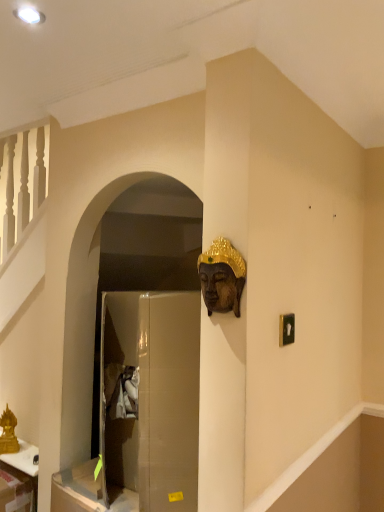
Identify the location of wooden golden mask at upper center. This screenshot has width=384, height=512. (222, 277).

This screenshot has height=512, width=384. What do you see at coordinates (222, 277) in the screenshot?
I see `wooden golden mask at upper center` at bounding box center [222, 277].

Where is `wooden golden mask at upper center`? The height and width of the screenshot is (512, 384). wooden golden mask at upper center is located at coordinates (222, 277).